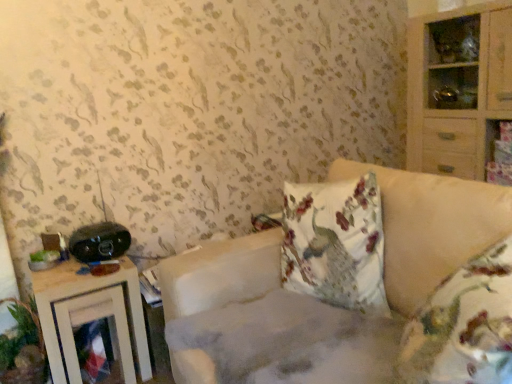
Question: From the image's perspective, is wooden nightstand at left below fluffy beige couch at center?

Choices:
 (A) no
 (B) yes

Answer: (B)

Question: Is wooden nightstand at left placed right next to fluffy beige couch at center?

Choices:
 (A) no
 (B) yes

Answer: (A)

Question: Considering the relative sizes of wooden nightstand at left and fluffy beige couch at center in the image provided, is wooden nightstand at left wider than fluffy beige couch at center?

Choices:
 (A) no
 (B) yes

Answer: (A)

Question: From a real-world perspective, is wooden nightstand at left under fluffy beige couch at center?

Choices:
 (A) yes
 (B) no

Answer: (A)

Question: Is wooden nightstand at left positioned with its back to fluffy beige couch at center?

Choices:
 (A) yes
 (B) no

Answer: (B)

Question: Is point (13, 355) closer or farther from the camera than point (457, 140)?

Choices:
 (A) closer
 (B) farther

Answer: (A)

Question: Considering the positions of green leafy plant at lower left and light wood cabinet at right in the image, is green leafy plant at lower left wider or thinner than light wood cabinet at right?

Choices:
 (A) wide
 (B) thin

Answer: (B)

Question: Is green leafy plant at lower left to the left or to the right of light wood cabinet at right in the image?

Choices:
 (A) right
 (B) left

Answer: (B)

Question: Considering the positions of green leafy plant at lower left and light wood cabinet at right in the image, is green leafy plant at lower left bigger or smaller than light wood cabinet at right?

Choices:
 (A) small
 (B) big

Answer: (A)

Question: Is black plastic stereo at left to the left or to the right of light wood cabinet at right in the image?

Choices:
 (A) left
 (B) right

Answer: (A)

Question: Considering the positions of black plastic stereo at left and light wood cabinet at right in the image, is black plastic stereo at left bigger or smaller than light wood cabinet at right?

Choices:
 (A) small
 (B) big

Answer: (A)

Question: From a real-world perspective, is black plastic stereo at left positioned above or below light wood cabinet at right?

Choices:
 (A) above
 (B) below

Answer: (B)

Question: In the image, is black plastic stereo at left positioned in front of or behind light wood cabinet at right?

Choices:
 (A) behind
 (B) front

Answer: (B)

Question: From a real-world perspective, relative to green leafy plant at lower left, is wooden nightstand at left vertically above or below?

Choices:
 (A) above
 (B) below

Answer: (B)

Question: Based on their sizes in the image, would you say wooden nightstand at left is bigger or smaller than green leafy plant at lower left?

Choices:
 (A) small
 (B) big

Answer: (B)